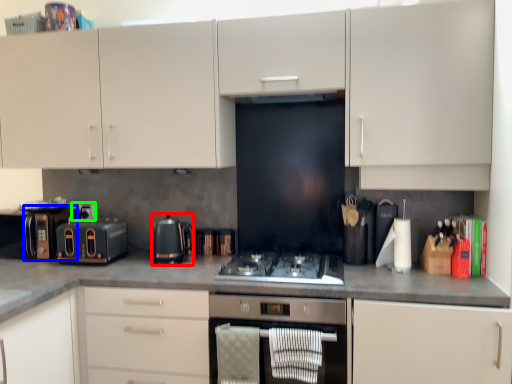
Question: Based on their relative distances, which object is nearer to kitchen appliance (highlighted by a red box)? Choose from appliance (highlighted by a blue box) and appliance (highlighted by a green box).

Choices:
 (A) appliance
 (B) appliance

Answer: (B)